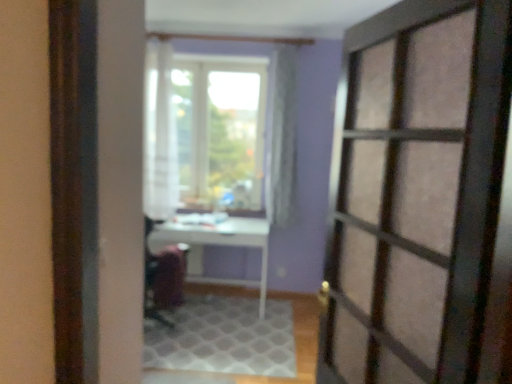
Question: Is velvet-like burgundy armchair at center far away from white textured rug at center?

Choices:
 (A) no
 (B) yes

Answer: (A)

Question: Is velvet-like burgundy armchair at center shorter than white textured rug at center?

Choices:
 (A) yes
 (B) no

Answer: (B)

Question: Considering the relative sizes of velvet-like burgundy armchair at center and white textured rug at center in the image provided, is velvet-like burgundy armchair at center bigger than white textured rug at center?

Choices:
 (A) no
 (B) yes

Answer: (A)

Question: Does velvet-like burgundy armchair at center have a greater width compared to white textured rug at center?

Choices:
 (A) no
 (B) yes

Answer: (A)

Question: Considering the relative sizes of velvet-like burgundy armchair at center and white textured rug at center in the image provided, is velvet-like burgundy armchair at center thinner than white textured rug at center?

Choices:
 (A) yes
 (B) no

Answer: (A)

Question: Is point (193, 238) closer or farther from the camera than point (224, 299)?

Choices:
 (A) farther
 (B) closer

Answer: (B)

Question: From the image's perspective, is white glossy table at center positioned above or below white textured rug at center?

Choices:
 (A) below
 (B) above

Answer: (B)

Question: Do you think white glossy table at center is within white textured rug at center, or outside of it?

Choices:
 (A) inside
 (B) outside

Answer: (B)

Question: Based on their sizes in the image, would you say white glossy table at center is bigger or smaller than white textured rug at center?

Choices:
 (A) big
 (B) small

Answer: (A)

Question: Visually, is white textured rug at center positioned to the left or to the right of velvet-like burgundy armchair at center?

Choices:
 (A) left
 (B) right

Answer: (B)

Question: Looking at the image, does white textured rug at center seem bigger or smaller compared to velvet-like burgundy armchair at center?

Choices:
 (A) small
 (B) big

Answer: (B)

Question: Considering the positions of white textured rug at center and velvet-like burgundy armchair at center in the image, is white textured rug at center taller or shorter than velvet-like burgundy armchair at center?

Choices:
 (A) short
 (B) tall

Answer: (A)

Question: Considering the positions of point (221, 317) and point (180, 263), is point (221, 317) closer or farther from the camera than point (180, 263)?

Choices:
 (A) closer
 (B) farther

Answer: (B)

Question: Is point (365, 177) closer or farther from the camera than point (287, 327)?

Choices:
 (A) farther
 (B) closer

Answer: (B)

Question: Looking at their shapes, would you say matte glass door at right is wider or thinner than white textured rug at center?

Choices:
 (A) thin
 (B) wide

Answer: (A)